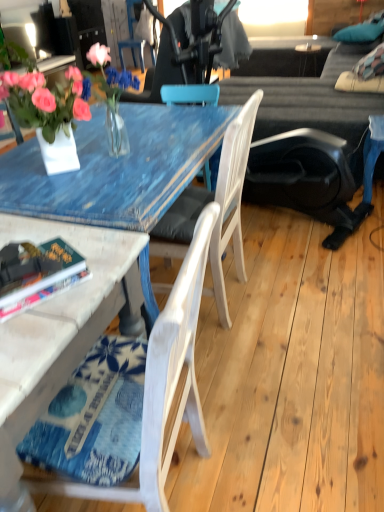
The height and width of the screenshot is (512, 384). Describe the element at coordinates (308, 47) in the screenshot. I see `matte white side table at lower right` at that location.

What do you see at coordinates (304, 94) in the screenshot? The height and width of the screenshot is (512, 384). I see `dark gray fabric couch at upper right` at bounding box center [304, 94].

Describe the element at coordinates (360, 32) in the screenshot. The width and height of the screenshot is (384, 512). I see `teal fabric pillow at upper right` at that location.

In order to face translucent glass vase at upper left, should I rotate leftwards or rightwards?

To face it directly, rotate left by 10.259 degrees.

The image size is (384, 512). What do you see at coordinates (231, 201) in the screenshot?
I see `white wood chair at center, which is the 2th chair from bottom to top` at bounding box center [231, 201].

This screenshot has height=512, width=384. Identify the location of matte white side table at lower right. (308, 47).

Could you tell me if matte white side table at lower right is facing dark gray fabric couch at upper right?

Yes, matte white side table at lower right is aimed at dark gray fabric couch at upper right.

Which of these two, matte white side table at lower right or dark gray fabric couch at upper right, is smaller?

With smaller size is matte white side table at lower right.

Based on the photo, considering the positions of objects matte white side table at lower right and dark gray fabric couch at upper right in the image provided, who is behind, matte white side table at lower right or dark gray fabric couch at upper right?

Positioned behind is matte white side table at lower right.

Would you consider matte white side table at lower right to be distant from dark gray fabric couch at upper right?

matte white side table at lower right is positioned a significant distance from dark gray fabric couch at upper right.

Relative to matte white side table at lower right, is dark gray fabric couch at upper right in front or behind?

Clearly, dark gray fabric couch at upper right is in front of matte white side table at lower right.

Can you tell me how much dark gray fabric couch at upper right and matte white side table at lower right differ in facing direction?

There is a 97.1-degree angle between the facing directions of dark gray fabric couch at upper right and matte white side table at lower right.

Considering the points (271, 58) and (301, 44), which point is behind, point (271, 58) or point (301, 44)?

The point (301, 44) is farther.

Considering the sizes of objects white wood chair at lower left, placed as the third chair when sorted from back to front, and dark gray fabric couch at upper right in the image provided, who is bigger, white wood chair at lower left, placed as the third chair when sorted from back to front, or dark gray fabric couch at upper right?

With larger size is dark gray fabric couch at upper right.

From the image's perspective, which is above, white wood chair at lower left, which ranks as the third chair in top-to-bottom order, or dark gray fabric couch at upper right?

dark gray fabric couch at upper right, from the image's perspective.

Would you consider white wood chair at lower left, which ranks as the third chair in top-to-bottom order, to be distant from dark gray fabric couch at upper right?

Yes.

At what (x,y) coordinates should I click in order to perform the action: click on studio couch directly beneath the white wood chair at lower left, which is counted as the 1th chair, starting from the front (from a real-world perspective). Please return your answer as a coordinate pair (x, y). This screenshot has height=512, width=384. Looking at the image, I should click on (304, 94).

Between translucent glass vase at upper left and wooden chair at upper center, which is the 3th chair from bottom to top, which one has smaller size?

translucent glass vase at upper left.

Which object is thinner, translucent glass vase at upper left or wooden chair at upper center, which is the 3th chair from bottom to top?

Thinner between the two is translucent glass vase at upper left.

Identify the location of floral arrangement below the wooden chair at upper center, the first chair viewed from the back (from the image's perspective). (109, 102).

Measure the distance from translucent glass vase at upper left to wooden chair at upper center, the first chair viewed from the back.

They are 4.12 feet apart.

Which of these two, hardcover book at lower left or wooden chair at upper center, the first chair viewed from the back, is bigger?

With larger size is wooden chair at upper center, the first chair viewed from the back.

Could you measure the distance between hardcover book at lower left and wooden chair at upper center, which is the 3th chair from bottom to top?

hardcover book at lower left and wooden chair at upper center, which is the 3th chair from bottom to top, are 7.14 feet apart from each other.

In the scene shown: Is hardcover book at lower left turned away from wooden chair at upper center, the first chair viewed from the back?

No, wooden chair at upper center, the first chair viewed from the back, is not at the back of hardcover book at lower left.

Are hardcover book at lower left and wooden chair at upper center, placed as the third chair when sorted from front to back, located far from each other?

Yes, hardcover book at lower left and wooden chair at upper center, placed as the third chair when sorted from front to back, are located far from each other.

From the image's perspective, is teal fabric pillow at upper right on top of white wood chair at lower left, which is counted as the 1th chair, starting from the front?

Yes, from the image's perspective, teal fabric pillow at upper right is over white wood chair at lower left, which is counted as the 1th chair, starting from the front.

Is the position of teal fabric pillow at upper right more distant than that of white wood chair at lower left, the 1th chair when ordered from bottom to top?

Yes, teal fabric pillow at upper right is further from the camera.

From a real-world perspective, is teal fabric pillow at upper right positioned under white wood chair at lower left, which ranks as the third chair in top-to-bottom order, based on gravity?

Incorrect, from a real-world perspective, teal fabric pillow at upper right is higher than white wood chair at lower left, which ranks as the third chair in top-to-bottom order.

Does white wood chair at center, which is the 2th chair from front to back, appear on the left side of white wood chair at lower left, which is counted as the 1th chair, starting from the front?

Incorrect, white wood chair at center, which is the 2th chair from front to back, is not on the left side of white wood chair at lower left, which is counted as the 1th chair, starting from the front.

Is white wood chair at center, which is the 2th chair from front to back, facing away from white wood chair at lower left, the 1th chair when ordered from bottom to top?

white wood chair at center, which is the 2th chair from front to back, does not have its back to white wood chair at lower left, the 1th chair when ordered from bottom to top.

This screenshot has height=512, width=384. I want to click on the 1st chair located above the white wood chair at center, which is the 2th chair from front to back (from a real-world perspective), so click(x=163, y=386).

Considering the positions of point (226, 314) and point (181, 275), is point (226, 314) closer or farther from the camera than point (181, 275)?

Point (226, 314) appears to be farther away from the viewer than point (181, 275).

The width and height of the screenshot is (384, 512). What are the coordinates of `studio couch lying in front of the matte white side table at lower right` in the screenshot? It's located at (304, 94).

This screenshot has height=512, width=384. In order to click on studio couch on the left side of matte white side table at lower right in this screenshot , I will do `click(304, 94)`.

When comparing their distances from dark gray fabric couch at upper right, does matte white side table at lower right or white wood chair at center, which is counted as the 2th chair, starting from the back, seem closer?

Based on the image, matte white side table at lower right appears to be nearer to dark gray fabric couch at upper right.

When comparing their distances from matte white side table at lower right, does white wood chair at lower left, which is counted as the 1th chair, starting from the front, or wooden chair at upper center, placed as the third chair when sorted from front to back, seem closer?

wooden chair at upper center, placed as the third chair when sorted from front to back.

When comparing their distances from teal fabric pillow at upper right, does translucent glass vase at upper left or white wood chair at lower left, the 1th chair when ordered from bottom to top, seem further?

white wood chair at lower left, the 1th chair when ordered from bottom to top.

From the image, which object appears to be nearer to matte white side table at lower right, white wood chair at lower left, which is counted as the 1th chair, starting from the front, or translucent glass vase at upper left?

translucent glass vase at upper left.

Looking at the image, which one is located closer to wooden chair at upper center, which is the 3th chair from bottom to top, white wood chair at center, which is the 2th chair from front to back, or dark gray fabric couch at upper right?

dark gray fabric couch at upper right is closer to wooden chair at upper center, which is the 3th chair from bottom to top.

Which object lies nearer to the anchor point teal fabric pillow at upper right, hardcover book at lower left or white wood chair at lower left, which ranks as the third chair in top-to-bottom order?

Among the two, white wood chair at lower left, which ranks as the third chair in top-to-bottom order, is located nearer to teal fabric pillow at upper right.

From the image, which object appears to be farther from teal fabric pillow at upper right, hardcover book at lower left or translucent glass vase at upper left?

Among the two, hardcover book at lower left is located further to teal fabric pillow at upper right.

In the scene shown: Based on their spatial positions, is matte white side table at lower right or dark gray fabric couch at upper right closer to white wood chair at center, which is the 2th chair from bottom to top?

dark gray fabric couch at upper right is closer to white wood chair at center, which is the 2th chair from bottom to top.

What are the coordinates of `side table between hardcover book at lower left and wooden chair at upper center, placed as the third chair when sorted from front to back, from front to back` in the screenshot? It's located at (308, 47).

Identify the location of floral arrangement located between white wood chair at center, which is the 2th chair from front to back, and wooden chair at upper center, which ranks as the 1th chair in top-to-bottom order, in the depth direction. This screenshot has width=384, height=512. (109, 102).

Locate an element on the screen. Image resolution: width=384 pixels, height=512 pixels. studio couch between hardcover book at lower left and matte white side table at lower right along the z-axis is located at coordinates (304, 94).

The image size is (384, 512). Identify the location of studio couch between white wood chair at center, which is the 2th chair from bottom to top, and teal fabric pillow at upper right, along the z-axis. (304, 94).